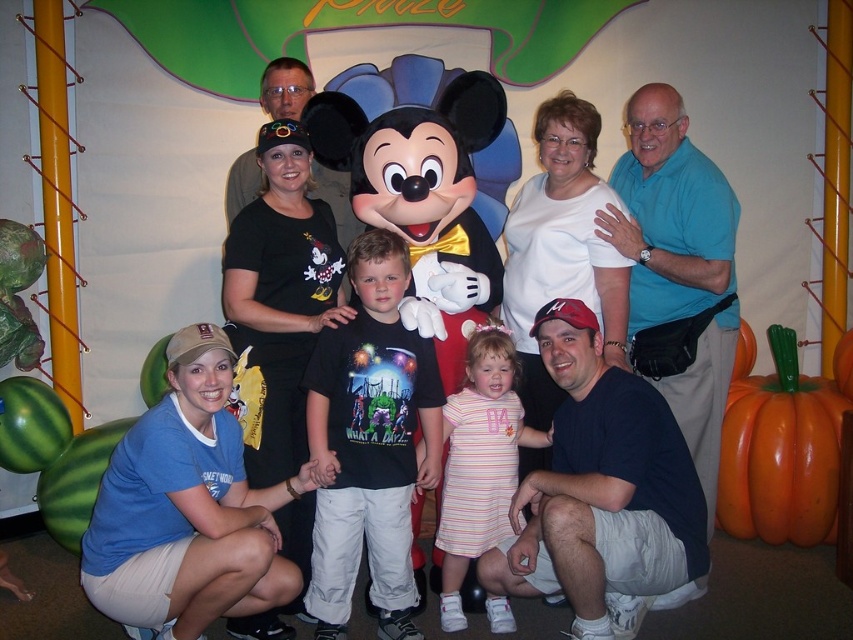
What is the color of the clothing item located at the coordinates point (187, 508)?

The clothing item at point (187, 508) is a blue cotton t shirt.

You are standing in front of the photo backdrop and want to place a small decoration between the two points labeled point [660,342] and point [672,225]. Which point should the decoration be closer to in order to be nearer to the viewer?

The decoration should be closer to point [660,342] because it is further to the viewer than point [672,225].